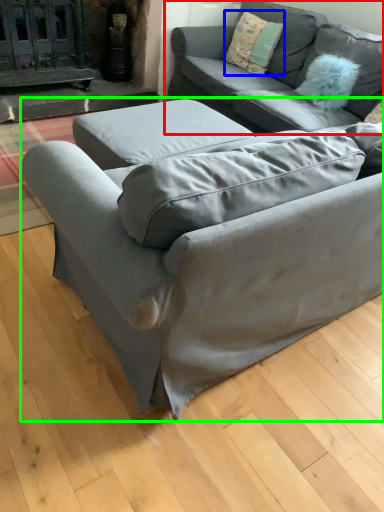
Question: Which object is positioned farthest from studio couch (highlighted by a red box)? Select from pillow (highlighted by a blue box) and studio couch (highlighted by a green box).

Choices:
 (A) pillow
 (B) studio couch

Answer: (B)